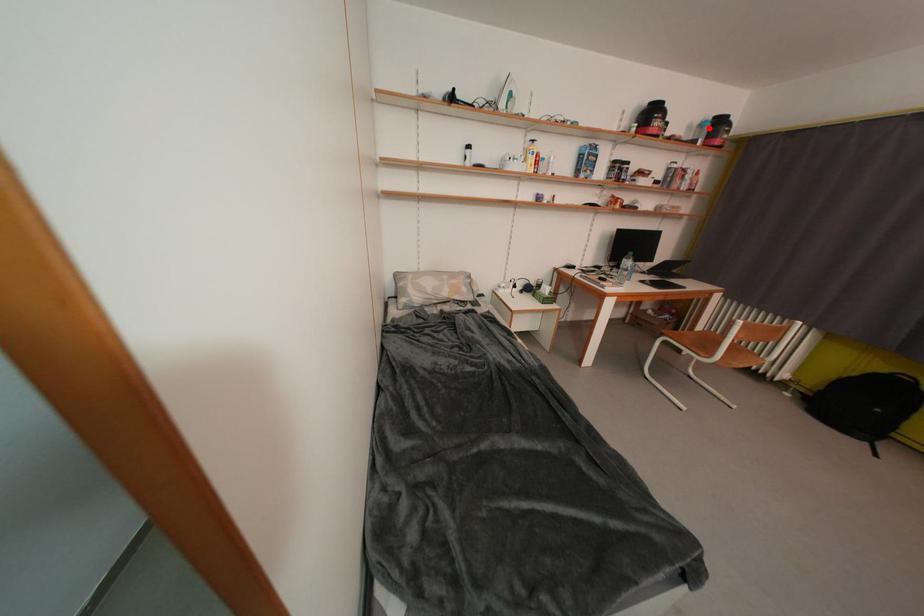
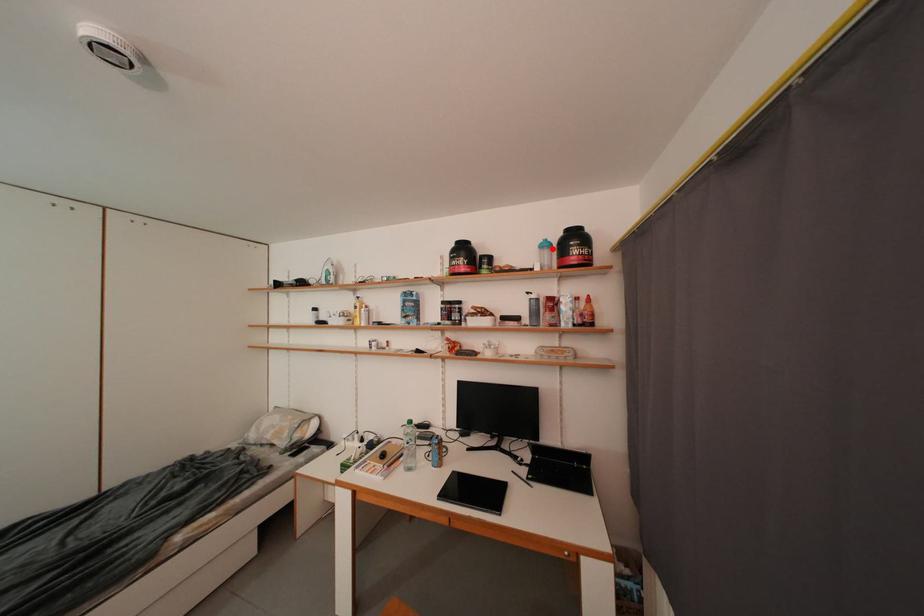
I am providing you with two images of the same scene from different viewpoints. A red point is marked on the first image and another point is marked on the second image. Is the red point in image1 aligned with the point shown in image2?

Yes